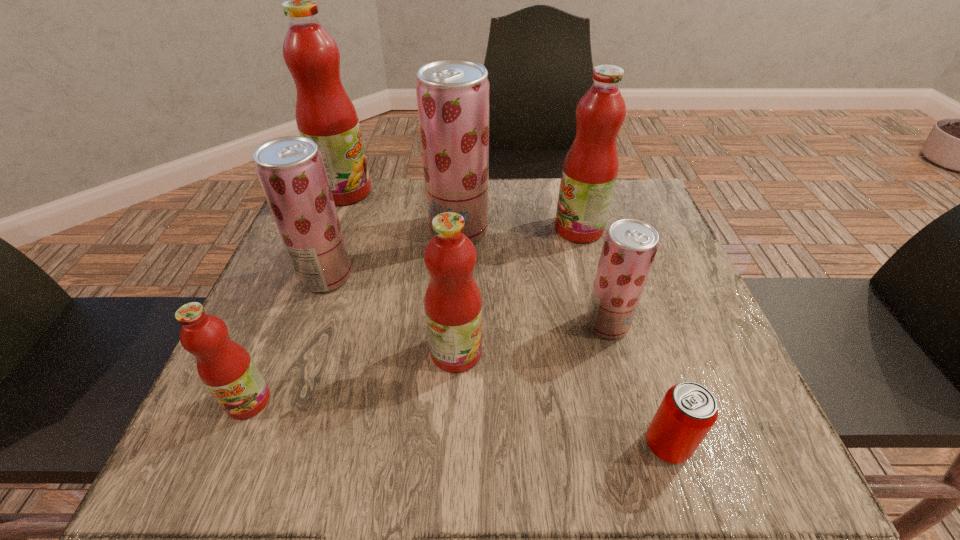
Where is `object located at the far right corner`? The height and width of the screenshot is (540, 960). object located at the far right corner is located at coordinates pos(590,168).

The width and height of the screenshot is (960, 540). Find the location of `object situated at the near right corner`. object situated at the near right corner is located at coordinates (688, 411).

Locate an element on the screen. This screenshot has width=960, height=540. blank area at the far edge is located at coordinates (408, 188).

In the image, there is a desktop. Where is `free space at the near edge`? The height and width of the screenshot is (540, 960). free space at the near edge is located at coordinates (556, 422).

I want to click on vacant region at the left edge, so click(308, 328).

Image resolution: width=960 pixels, height=540 pixels. In order to click on vacant region at the right edge of the desktop in this screenshot , I will do `click(656, 411)`.

This screenshot has height=540, width=960. What are the coordinates of `blank area at the near left corner` in the screenshot? It's located at (245, 431).

The image size is (960, 540). Find the location of `vacant space at the far right corner`. vacant space at the far right corner is located at coordinates (646, 194).

Find the location of a particular element. Image resolution: width=960 pixels, height=540 pixels. free space between the nearest object and the second smallest pink fruit juice is located at coordinates (562, 399).

The width and height of the screenshot is (960, 540). In order to click on free space between the second farthest pink fruit juice and the smallest strawberry fruit juice in this screenshot , I will do `click(593, 276)`.